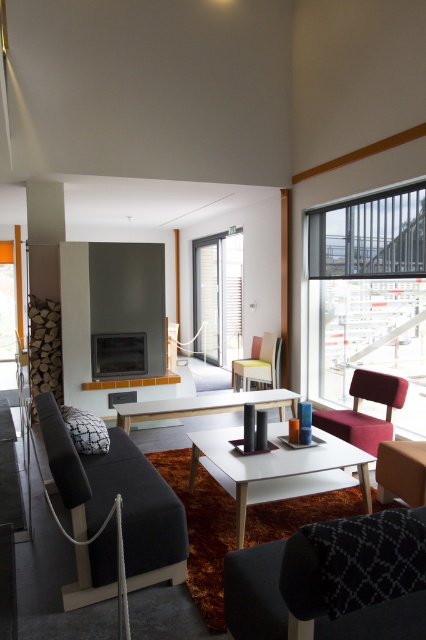
Between point (359, 586) and point (301, 467), which one is positioned in front?

Positioned in front is point (359, 586).

Who is more distant from viewer, (342, 548) or (232, 476)?

The point (232, 476) is more distant.

Find the location of a particular element. The width and height of the screenshot is (426, 640). dark gray fabric armchair at lower right is located at coordinates (331, 580).

Identify the location of transparent glass window at upper right. Image resolution: width=426 pixels, height=640 pixels. (368, 296).

Is point (422, 260) closer to viewer compared to point (325, 435)?

No, (422, 260) is further to viewer.

Where is `transparent glass window at upper right`? transparent glass window at upper right is located at coordinates (368, 296).

Consider the image. Measure the distance from matte black fireplace at center to yellow fabric armchair at center.

matte black fireplace at center is 1.59 meters from yellow fabric armchair at center.

Is point (106, 365) farther from camera compared to point (236, 369)?

No, (106, 365) is in front of (236, 369).

The width and height of the screenshot is (426, 640). What do you see at coordinates (118, 355) in the screenshot?
I see `matte black fireplace at center` at bounding box center [118, 355].

You are a GUI agent. You are given a task and a screenshot of the screen. Output one action in this format:
    pyautogui.click(x=<x>, y=<y>)
    Task: Click on the matte black fireplace at center
    
    Given the screenshot: What is the action you would take?
    pyautogui.click(x=118, y=355)